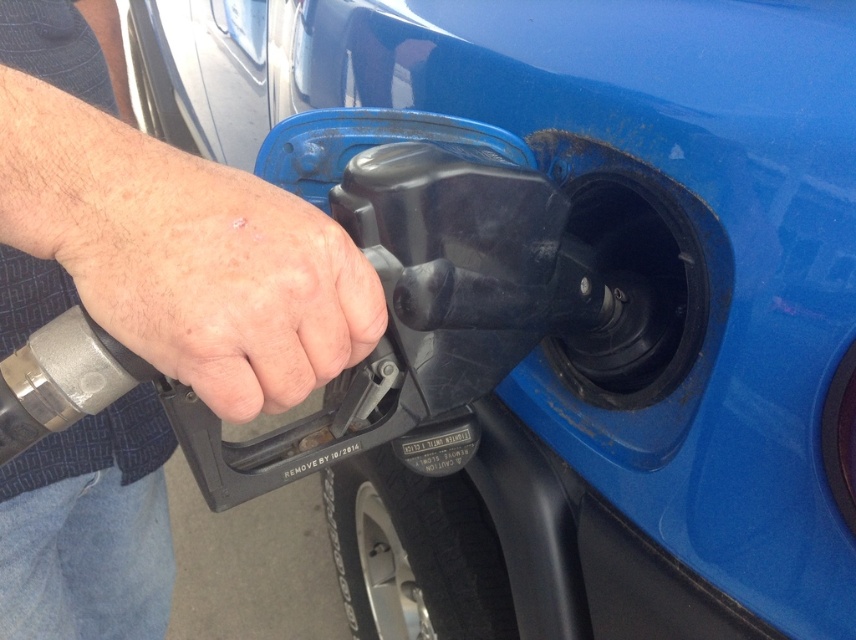
Question: Can you confirm if gray matte fuel nozzle at center is bigger than dry skin at center?

Choices:
 (A) yes
 (B) no

Answer: (A)

Question: Is gray matte fuel nozzle at center bigger than dry skin at center?

Choices:
 (A) no
 (B) yes

Answer: (B)

Question: From the image, what is the correct spatial relationship of gray matte fuel nozzle at center in relation to dry skin at center?

Choices:
 (A) right
 (B) left

Answer: (B)

Question: Which of the following is the farthest from the observer?

Choices:
 (A) gray matte fuel nozzle at center
 (B) dry skin at center

Answer: (B)

Question: Which object appears farthest from the camera in this image?

Choices:
 (A) dry skin at center
 (B) gray matte fuel nozzle at center

Answer: (A)

Question: Which object is farther from the camera taking this photo?

Choices:
 (A) dry skin at center
 (B) gray matte fuel nozzle at center

Answer: (A)